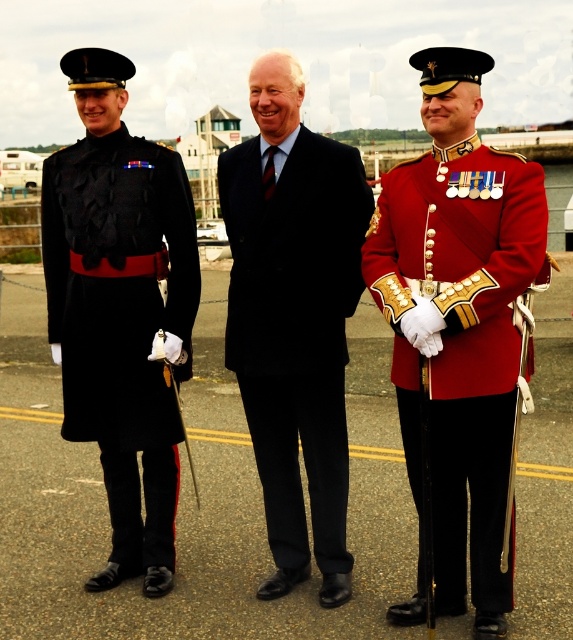
Looking at the three people in the image, which of the two central outfits, the shiny red fabric jacket at center or the navy wool suit at center, is positioned to the right?

The shiny red fabric jacket at center is to the right of the navy wool suit at center.

You are a photographer setting up for a group photo. You need to position the matte black coat at left and the navy wool suit at center so that both are visible in the frame. Given their heights, which of the two should be placed closer to the camera to ensure their faces are equally visible?

The navy wool suit at center should be placed closer to the camera because the matte black coat at left is taller than the navy wool suit at center. This adjustment will help balance their visibility in the photo.